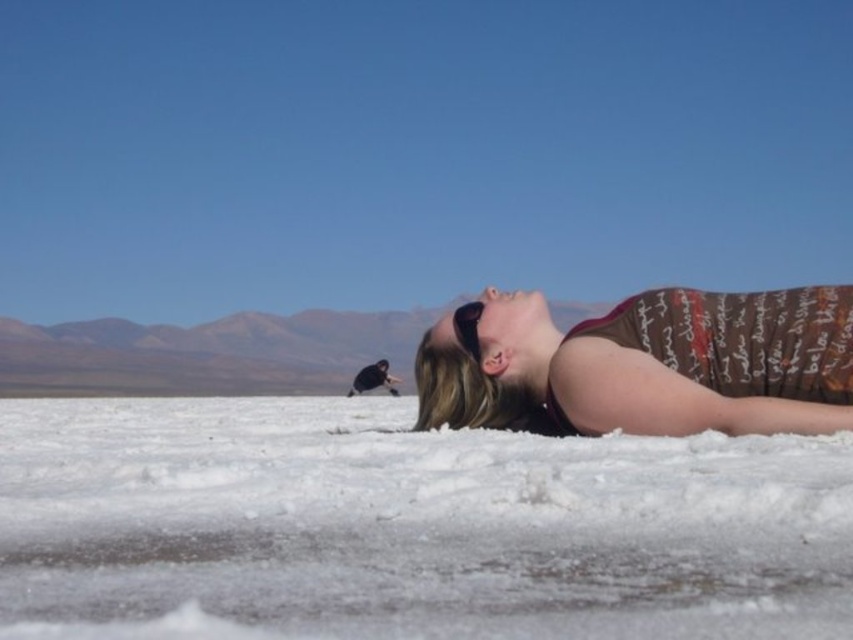
Question: Among these points, which one is farthest from the camera?

Choices:
 (A) (820, 312)
 (B) (405, 467)
 (C) (778, 337)
 (D) (465, 342)

Answer: (D)

Question: Can you confirm if brown printed tank top at center is positioned above black matte sunglasses at upper center?

Choices:
 (A) yes
 (B) no

Answer: (B)

Question: Which object is farther from the camera taking this photo?

Choices:
 (A) brown printed fabric at lower right
 (B) brown printed tank top at center
 (C) black matte sunglasses at upper center
 (D) white powdery snow at lower center

Answer: (C)

Question: Which object is positioned farthest from the white powdery snow at lower center?

Choices:
 (A) brown printed tank top at center
 (B) brown printed fabric at lower right
 (C) black matte sunglasses at upper center

Answer: (C)

Question: Is white powdery snow at lower center above brown printed fabric at lower right?

Choices:
 (A) no
 (B) yes

Answer: (A)

Question: From the image, what is the correct spatial relationship of white powdery snow at lower center in relation to brown printed fabric at lower right?

Choices:
 (A) above
 (B) below

Answer: (B)